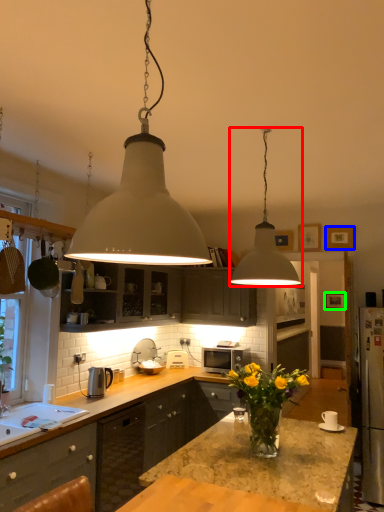
Question: Based on their relative distances, which object is farther from lamp (highlighted by a red box)? Choose from picture frame (highlighted by a blue box) and picture frame (highlighted by a green box).

Choices:
 (A) picture frame
 (B) picture frame

Answer: (B)